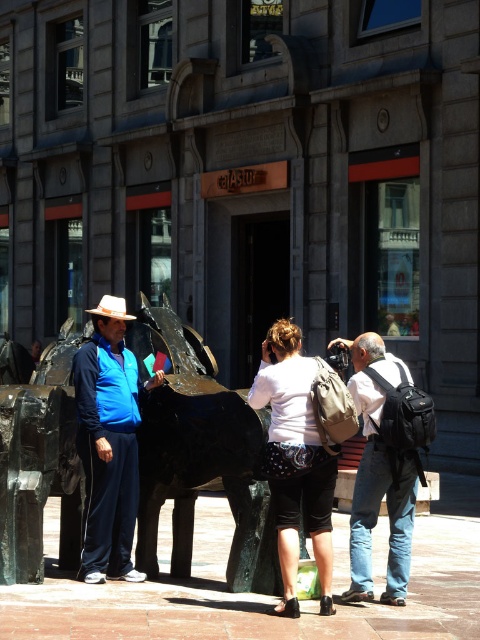
You are a tourist who wants to take a photo of the matte black backpack at center and the green polished stone sculpture at center. To ensure both are in the frame, where should you position yourself relative to the sculpture?

You should position yourself to the right of the green polished stone sculpture at center so that both the sculpture and the matte black backpack at center are visible in the frame since the sculpture is to the left of the backpack.

You are a street performer planning to set up a booth between the green polished stone sculpture at center and the blue fabric jacket at left. Given that your booth requires a minimum of 1.2 meters of space, can you determine if there is enough room based on the sculpture and jacket sizes?

The green polished stone sculpture at center is wider than the blue fabric jacket at left, but the exact dimensions aren